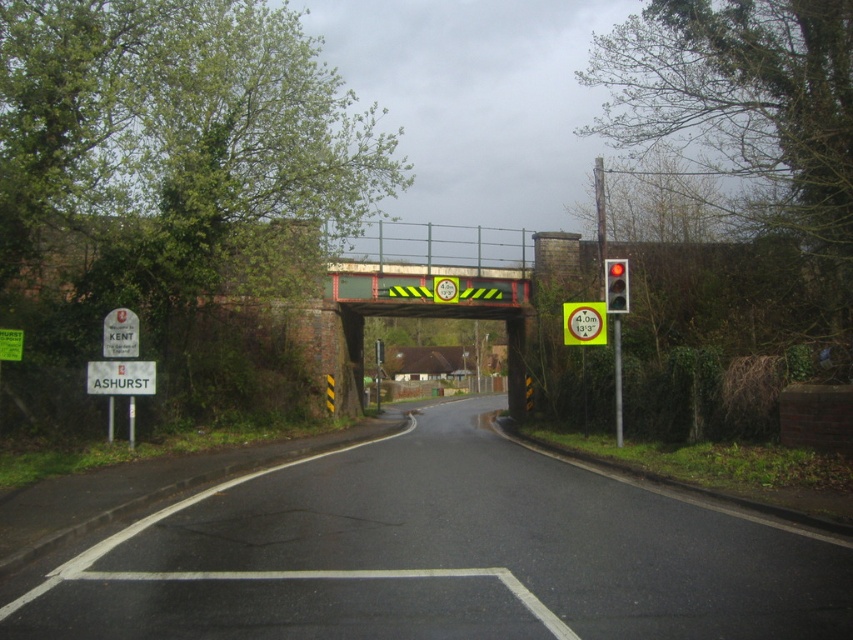
Question: Which object is farther from the camera taking this photo?

Choices:
 (A) red glass traffic light at right
 (B) yellow reflective circle at upper center
 (C) metallic rectangular sign at left
 (D) white plastic sign at lower left

Answer: (B)

Question: Which object appears closest to the camera in this image?

Choices:
 (A) metallic rectangular sign at left
 (B) white plastic sign at lower left
 (C) green plastic pole at right

Answer: (A)

Question: Is white plastic sign at lower left to the left of green plastic pole at right from the viewer's perspective?

Choices:
 (A) no
 (B) yes

Answer: (B)

Question: Which object is farther from the camera taking this photo?

Choices:
 (A) white plastic sign at lower left
 (B) yellow reflective circle at upper center

Answer: (B)

Question: Can you confirm if white plastic sign at lower left is bigger than metallic rectangular sign at left?

Choices:
 (A) no
 (B) yes

Answer: (B)

Question: Is white plastic sign at lower left in front of metallic rectangular sign at left?

Choices:
 (A) no
 (B) yes

Answer: (A)